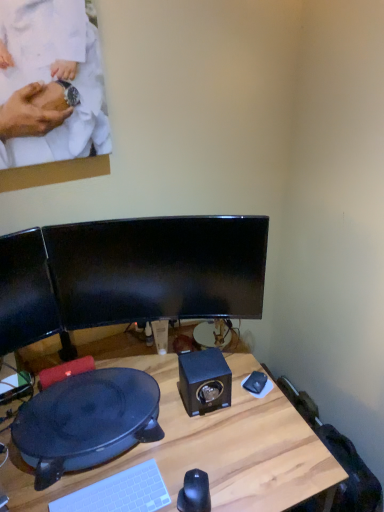
Locate an element on the screen. This screenshot has height=512, width=384. vacant region below white plastic keyboard at lower center (from a real-world perspective) is located at coordinates click(x=115, y=497).